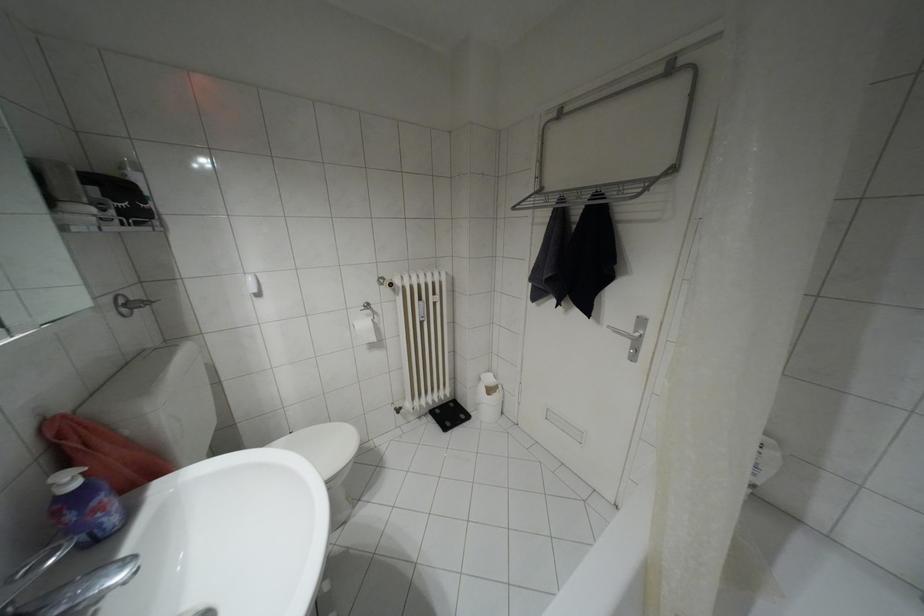
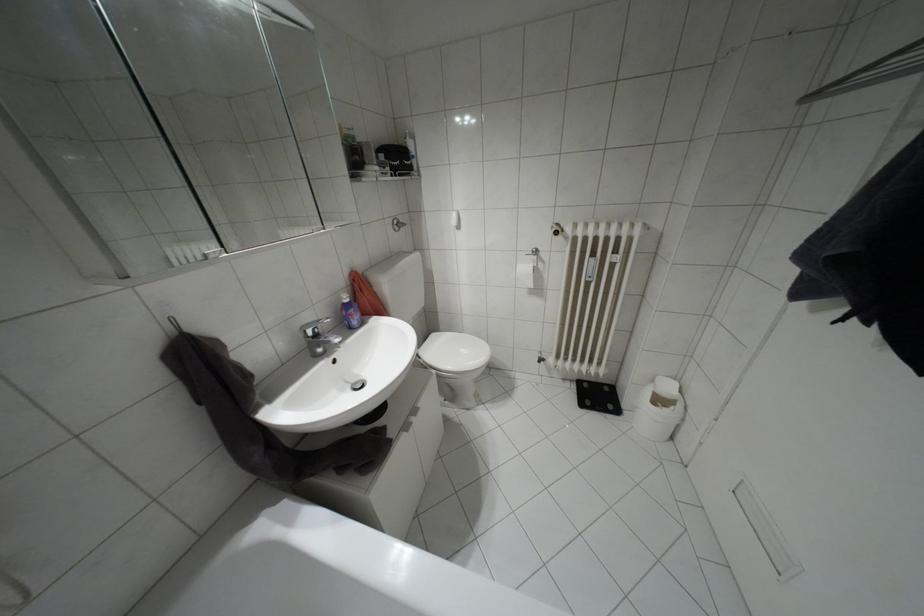
The point at (x=75, y=484) is marked in the first image. Where is the corresponding point in the second image?

(346, 300)